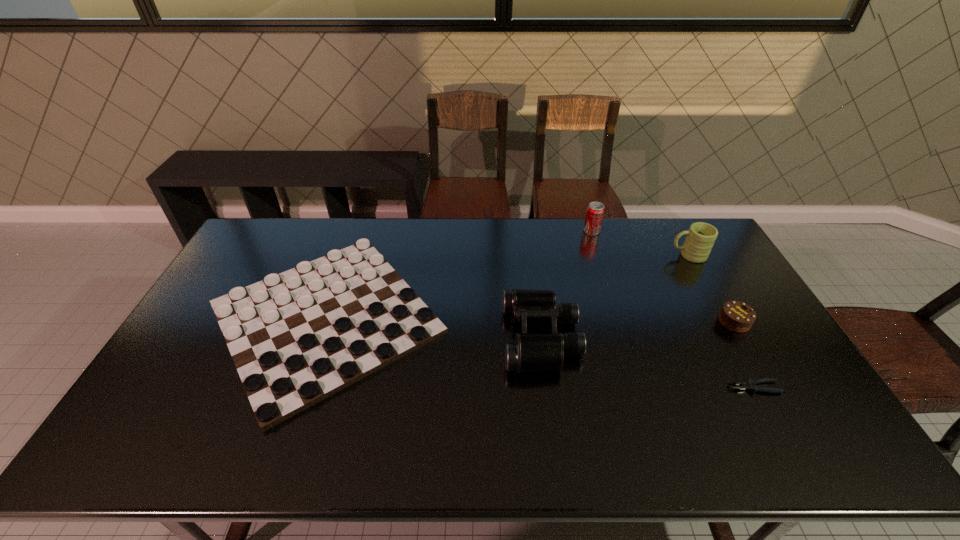
Locate an element on the screen. The height and width of the screenshot is (540, 960). soda can that is at the far edge is located at coordinates (595, 211).

You are a GUI agent. You are given a task and a screenshot of the screen. Output one action in this format:
    pyautogui.click(x=<x>, y=<y>)
    Task: Click on the mug that is at the far edge
    This screenshot has height=540, width=960.
    Given the screenshot: What is the action you would take?
    pyautogui.click(x=701, y=236)

Find the location of a particular element. gameboard at the far edge is located at coordinates (296, 338).

Locate an element on the screen. The image size is (960, 540). object at the near edge is located at coordinates (296, 338).

What are the coordinates of `object that is at the left edge` in the screenshot? It's located at (296, 338).

The height and width of the screenshot is (540, 960). In order to click on mug present at the right edge in this screenshot , I will do `click(701, 236)`.

Locate an element on the screen. The image size is (960, 540). chocolate cake at the right edge is located at coordinates (736, 316).

Find the location of `pliers located at the right edge`. pliers located at the right edge is located at coordinates (749, 383).

The width and height of the screenshot is (960, 540). I want to click on object that is at the far left corner, so click(x=296, y=338).

The height and width of the screenshot is (540, 960). I want to click on object at the near left corner, so click(296, 338).